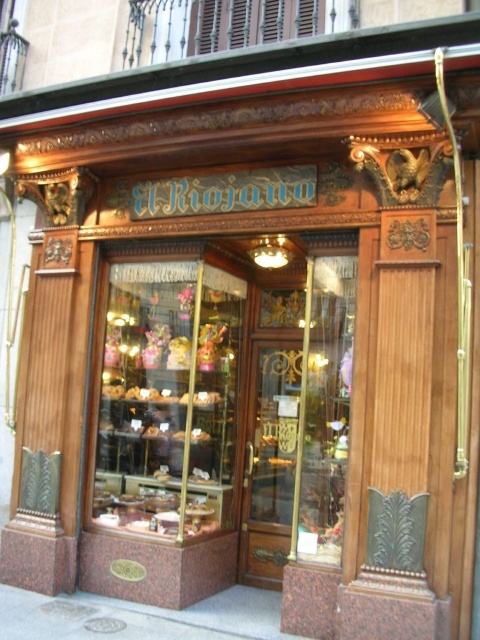
Is point (111, 428) positioned before point (284, 390)?

That is True.

Does marble-like glass display case at center come behind gold polished wood door at center?

No, it is in front of gold polished wood door at center.

Locate an element on the screen. The image size is (480, 640). marble-like glass display case at center is located at coordinates (220, 426).

Can you confirm if shiny glass display case at center is wider than gold polished wood door at center?

Yes.

Does shiny glass display case at center appear on the right side of gold polished wood door at center?

In fact, shiny glass display case at center is to the left of gold polished wood door at center.

Is point (201, 500) farther from camera compared to point (249, 570)?

No.

Locate an element on the screen. shiny glass display case at center is located at coordinates (168, 400).

Does marble-like glass display case at center appear under shiny glass display case at center?

Yes.

Who is more distant from viewer, (257, 568) or (184, 346)?

The point (257, 568) is more distant.

Is point (115, 380) more distant than point (173, 310)?

No, it is in front of (173, 310).

At what (x,y) coordinates should I click in order to perform the action: click on marble-like glass display case at center. Please return your answer as a coordinate pair (x, y). Looking at the image, I should click on (220, 426).